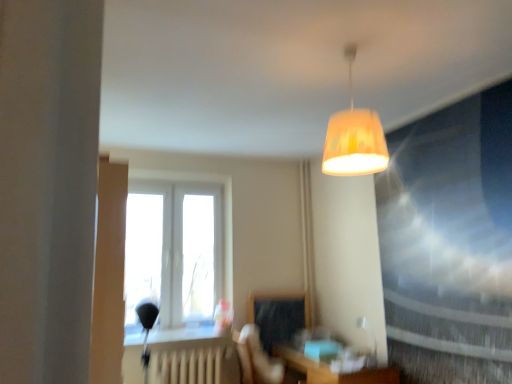
Find the location of a particular element. Image resolution: width=512 pixels, height=384 pixels. matte yellow lampshade at center is located at coordinates (354, 137).

What do you see at coordinates (354, 137) in the screenshot? I see `matte yellow lampshade at center` at bounding box center [354, 137].

This screenshot has width=512, height=384. What do you see at coordinates (370, 340) in the screenshot?
I see `white glossy table lamp at lower right` at bounding box center [370, 340].

The height and width of the screenshot is (384, 512). What do you see at coordinates (188, 366) in the screenshot?
I see `white matte radiator at lower center` at bounding box center [188, 366].

Locate an element on the screen. The height and width of the screenshot is (384, 512). matte black swivel chair at center is located at coordinates click(x=257, y=358).

Considering the points (425, 196) and (250, 380), which point is in front, point (425, 196) or point (250, 380)?

The point (425, 196) is closer.

From the image's perspective, is matte glass window screen at upper right on top of matte black swivel chair at center?

Yes.

Considering the relative positions of matte glass window screen at upper right and matte black swivel chair at center in the image provided, is matte glass window screen at upper right to the left or to the right of matte black swivel chair at center?

In the image, matte glass window screen at upper right appears on the right side of matte black swivel chair at center.

Do you think white matte radiator at lower center is within wooden table at lower center, or outside of it?

white matte radiator at lower center exists outside the volume of wooden table at lower center.

Can you confirm if white matte radiator at lower center is positioned to the right of wooden table at lower center?

No, white matte radiator at lower center is not to the right of wooden table at lower center.

Considering the sizes of objects white matte radiator at lower center and wooden table at lower center in the image provided, who is bigger, white matte radiator at lower center or wooden table at lower center?

With larger size is wooden table at lower center.

Which of these two, wooden table at lower center or matte glass window screen at upper right, is wider?

wooden table at lower center is wider.

Is wooden table at lower center facing towards matte glass window screen at upper right?

No, wooden table at lower center is not turned towards matte glass window screen at upper right.

In the scene shown: Considering the relative positions of wooden table at lower center and matte glass window screen at upper right in the image provided, is wooden table at lower center to the left or to the right of matte glass window screen at upper right?

Clearly, wooden table at lower center is on the left of matte glass window screen at upper right in the image.

Is matte yellow lampshade at center aimed at wooden table at lower center?

No, matte yellow lampshade at center is not facing towards wooden table at lower center.

Between matte yellow lampshade at center and wooden table at lower center, which one is positioned in front?

matte yellow lampshade at center is closer to the camera.

From the picture: Can you confirm if matte yellow lampshade at center is taller than wooden table at lower center?

Correct, matte yellow lampshade at center is much taller as wooden table at lower center.

Find the location of `lamp located above the wooden table at lower center (from a real-world perspective)`. lamp located above the wooden table at lower center (from a real-world perspective) is located at coordinates (354, 137).

Looking at this image, considering the sizes of objects white plastic window at center and matte black swivel chair at center in the image provided, who is taller, white plastic window at center or matte black swivel chair at center?

Standing taller between the two is white plastic window at center.

Choose the correct answer: Is white plastic window at center inside matte black swivel chair at center or outside it?

white plastic window at center is spatially situated outside matte black swivel chair at center.

Does point (187, 183) appear closer or farther from the camera than point (249, 335)?

Point (187, 183) appears to be farther away from the viewer than point (249, 335).

What's the angular difference between white plastic window at center and matte black swivel chair at center's facing directions?

There is a 90-degree angle between the facing directions of white plastic window at center and matte black swivel chair at center.

You are a GUI agent. You are given a task and a screenshot of the screen. Output one action in this format:
    pyautogui.click(x=<x>, y=<y>)
    Task: Click on the table below the matte yellow lampshade at center (from a real-world perspective)
    
    Given the screenshot: What is the action you would take?
    pyautogui.click(x=331, y=371)

Is wooden table at lower center wider or thinner than matte yellow lampshade at center?

Considering their sizes, wooden table at lower center looks broader than matte yellow lampshade at center.

In the scene shown: Which of these two, wooden table at lower center or matte yellow lampshade at center, is smaller?

matte yellow lampshade at center is smaller.

From a real-world perspective, relative to matte yellow lampshade at center, is wooden table at lower center vertically above or below?

wooden table at lower center is situated lower than matte yellow lampshade at center in the real world.

Where is `radiator behind the matte black swivel chair at center`? Image resolution: width=512 pixels, height=384 pixels. radiator behind the matte black swivel chair at center is located at coordinates (188, 366).

From the image's perspective, which is below, white matte radiator at lower center or matte black swivel chair at center?

white matte radiator at lower center is shown below in the image.

Is white matte radiator at lower center completely or partially outside of matte black swivel chair at center?

Yes, white matte radiator at lower center is outside of matte black swivel chair at center.

Looking at this image, is white matte radiator at lower center at the right side of matte black swivel chair at center?

No.

At what (x,y) coordinates should I click in order to perform the action: click on window screen in front of the matte black swivel chair at center. Please return your answer as a coordinate pair (x, y). Looking at the image, I should click on (450, 229).

Where is `table on the right of white matte radiator at lower center`? The height and width of the screenshot is (384, 512). table on the right of white matte radiator at lower center is located at coordinates (331, 371).

Based on their spatial positions, is matte yellow lampshade at center or white matte radiator at lower center closer to white glossy table lamp at lower right?

Among the two, white matte radiator at lower center is located nearer to white glossy table lamp at lower right.

Based on their spatial positions, is white matte radiator at lower center or matte black swivel chair at center further from wooden table at lower center?

white matte radiator at lower center lies further to wooden table at lower center than the other object.

Looking at the image, which one is located further to matte black swivel chair at center, white glossy table lamp at lower right or white matte radiator at lower center?

The object further to matte black swivel chair at center is white glossy table lamp at lower right.

Considering their positions, is white glossy table lamp at lower right positioned closer to matte glass window screen at upper right than white matte radiator at lower center?

Among the two, white glossy table lamp at lower right is located nearer to matte glass window screen at upper right.

Based on their spatial positions, is matte black swivel chair at center or white glossy table lamp at lower right closer to white matte radiator at lower center?

matte black swivel chair at center lies closer to white matte radiator at lower center than the other object.

Estimate the real-world distances between objects in this image. Which object is closer to white plastic window at center, wooden table at lower center or white matte radiator at lower center?

white matte radiator at lower center.

From the image, which object appears to be farther from matte black swivel chair at center, white matte radiator at lower center or matte glass window screen at upper right?

Among the two, matte glass window screen at upper right is located further to matte black swivel chair at center.

From the image, which object appears to be farther from matte yellow lampshade at center, white glossy table lamp at lower right or white matte radiator at lower center?

Based on the image, white matte radiator at lower center appears to be further to matte yellow lampshade at center.

I want to click on table lamp that lies between matte yellow lampshade at center and white matte radiator at lower center from top to bottom, so click(370, 340).

Identify the location of table located between white matte radiator at lower center and white glossy table lamp at lower right in the left-right direction. This screenshot has width=512, height=384. (331, 371).

The image size is (512, 384). Find the location of `radiator located between white plastic window at center and matte glass window screen at upper right in the left-right direction`. radiator located between white plastic window at center and matte glass window screen at upper right in the left-right direction is located at coordinates (188, 366).

What are the coordinates of `table lamp between matte yellow lampshade at center and wooden table at lower center in the up-down direction` in the screenshot? It's located at (370, 340).